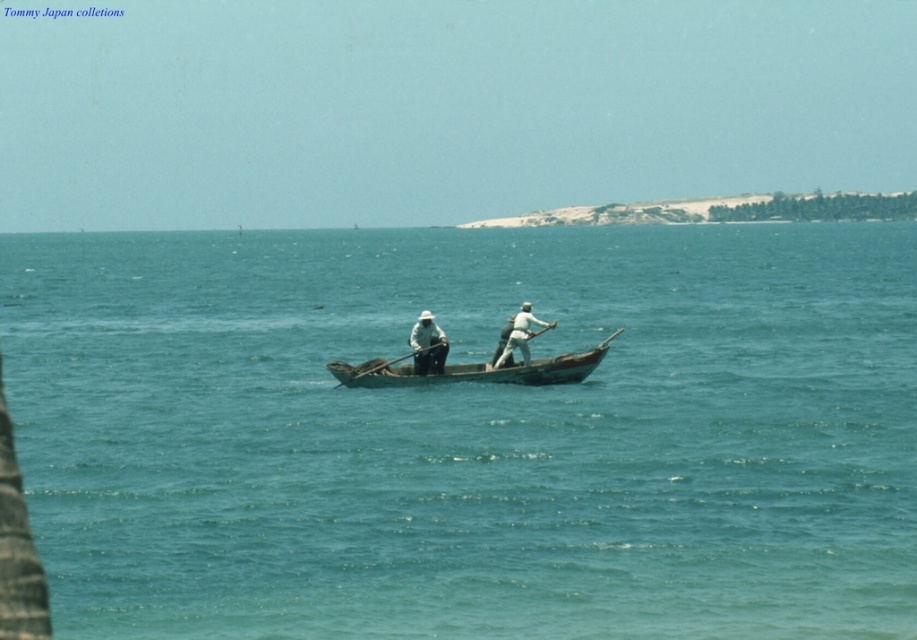
You are standing on the boat and want to grab the white matte hat at center and the wooden paddle at center. Which object should you move towards first if you are facing the front of the boat?

The wooden paddle at center is to the left of the white matte hat at center. Since you are facing the front of the boat, you should move towards the wooden paddle at center first to reach the hat.

You are in a small wooden boat in the middle of calm turquoise waters. You need to reach the wooden canoe at center to retrieve a fishing net. Can you move towards it without stepping on the light brown wooden paddle at center?

The wooden canoe at center is in front of the light brown wooden paddle at center, so you can move towards the wooden canoe at center without stepping on the light brown wooden paddle at center.